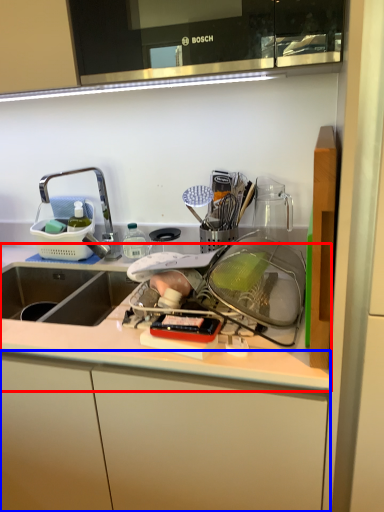
Question: Which of the following is the closest to the observer, countertop (highlighted by a red box) or cabinetry (highlighted by a blue box)?

Choices:
 (A) countertop
 (B) cabinetry

Answer: (A)